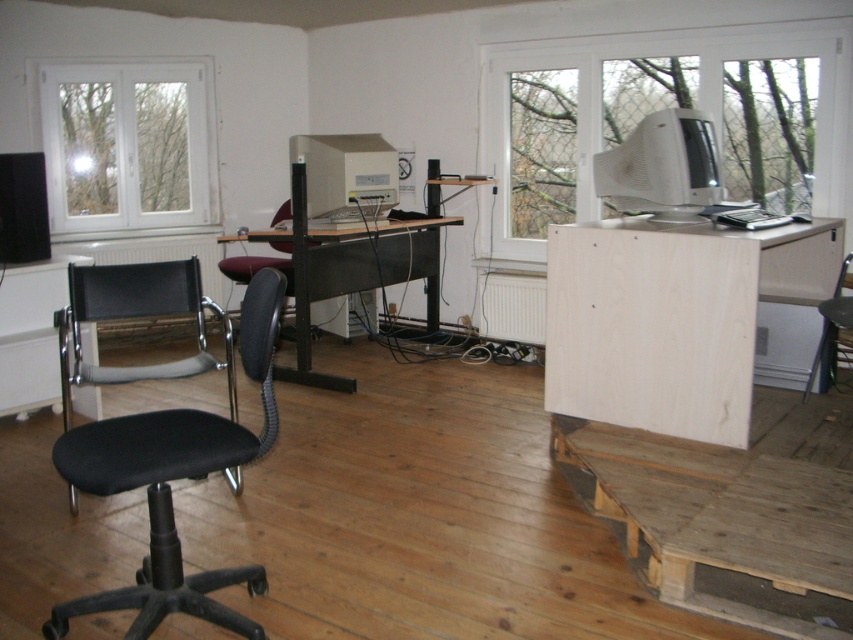
You are organizing a room and want to place a new plant stand. The plant stand needs to be placed in front of the white plastic window at upper left so it gets sunlight. Can the metallic black desk at center be moved out of the way to allow this?

The metallic black desk at center is behind the white plastic window at upper left, so moving it would allow the plant stand to be placed in front of the window.

You are moving a large box that is 1.2 meters wide. You need to pass between the plywood desk at right and the weathered wood pallet at lower right. Can you fit through the space between them?

The plywood desk at right might be wider than weathered wood pallet at lower right, so the space between them may not be wide enough for the large box that is 1.2 meters wide. You should check the exact width before attempting to move the box through.

You are sitting in the black fabric chair at lower right and want to reach the matte black keyboard at right. Can you easily access it without moving your chair?

The black fabric chair at lower right is positioned under the matte black keyboard at right, so you can easily access it without moving your chair.